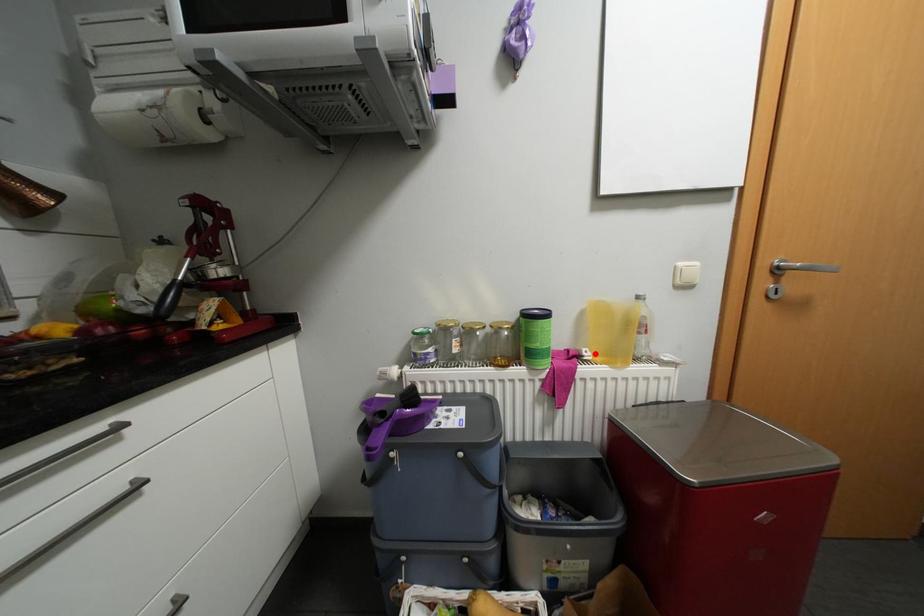
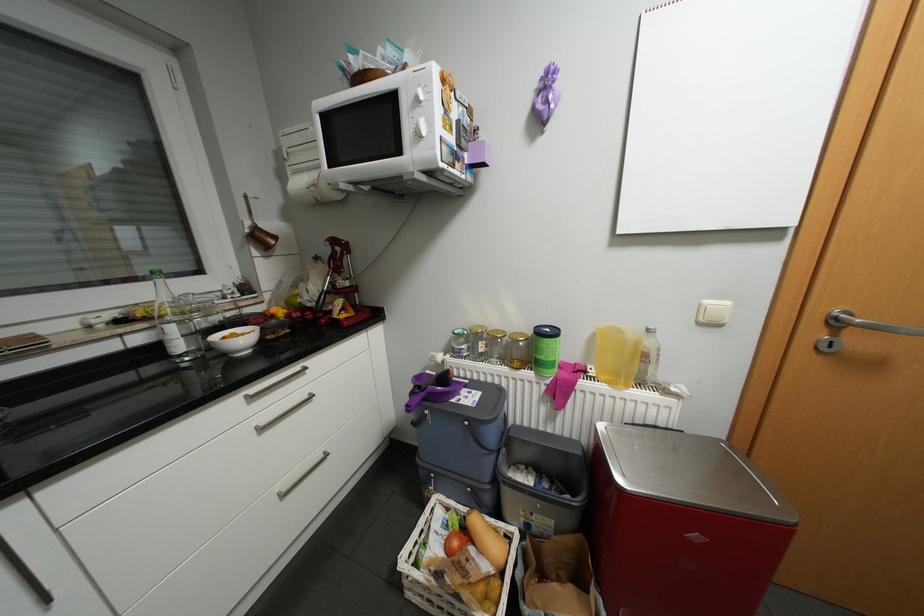
Where in the second image is the point corresponding to the highlighted location from the first image?

(600, 371)